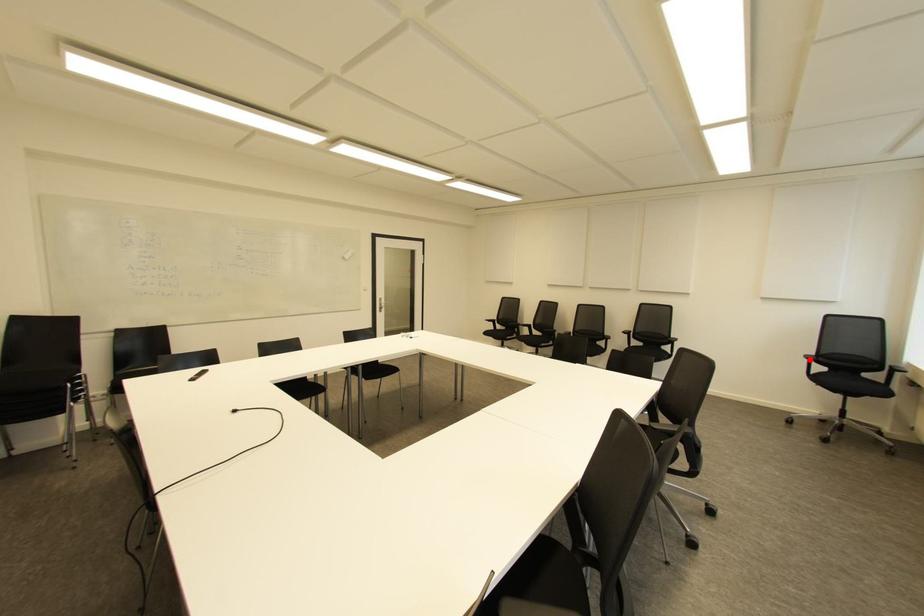
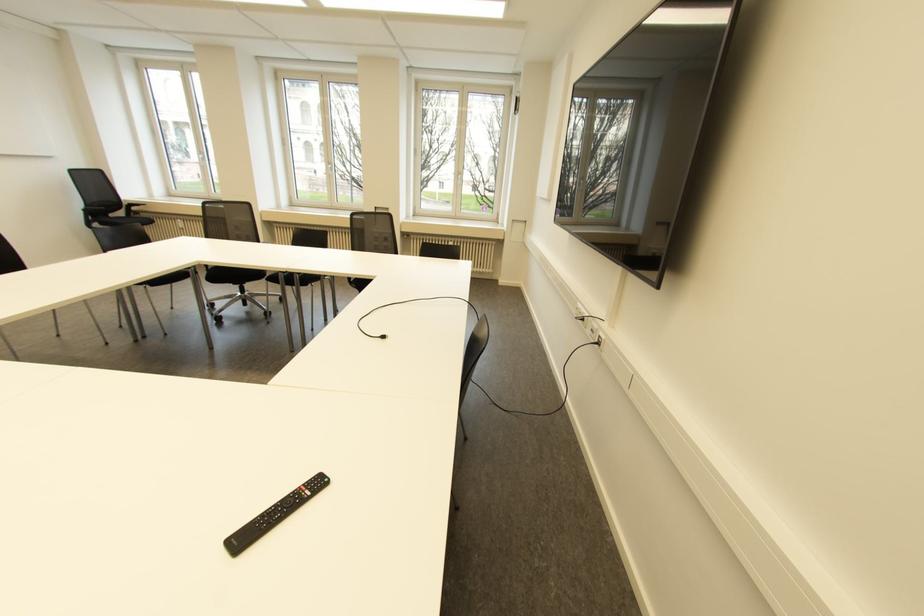
Find the pixel in the second image that matches the highlighted location in the first image.

(86, 211)